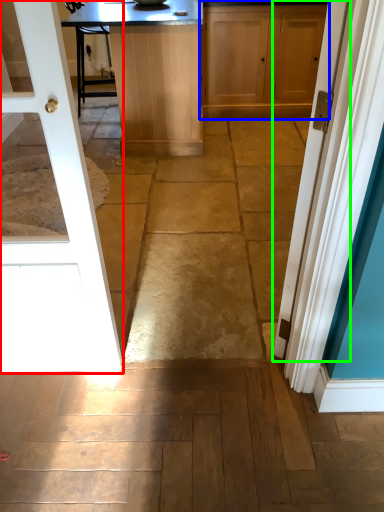
Question: Based on their relative distances, which object is nearer to door (highlighted by a red box)? Choose from cabinetry (highlighted by a blue box) and door (highlighted by a green box).

Choices:
 (A) cabinetry
 (B) door

Answer: (B)